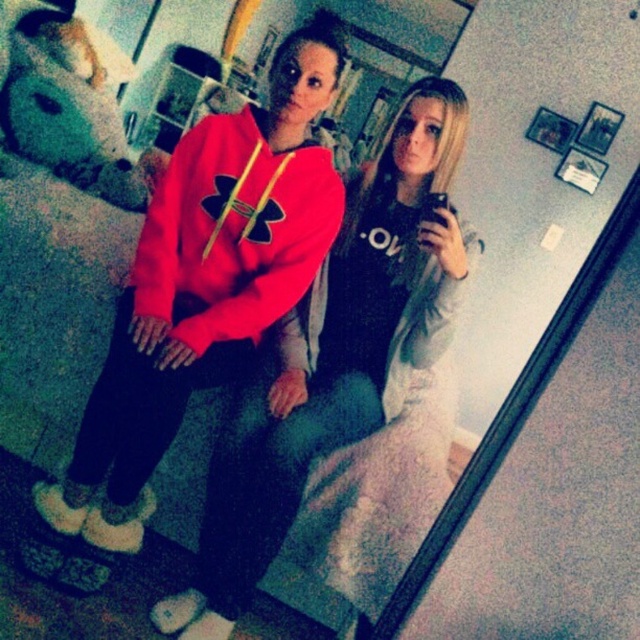
Is matte fleece hoodie at center shorter than matte red hoodie at center?

Indeed, matte fleece hoodie at center has a lesser height compared to matte red hoodie at center.

Is matte fleece hoodie at center positioned at the back of matte red hoodie at center?

That is True.

Between point (198, 296) and point (257, 516), which one is positioned behind?

Positioned behind is point (198, 296).

The width and height of the screenshot is (640, 640). Identify the location of matte fleece hoodie at center. (205, 280).